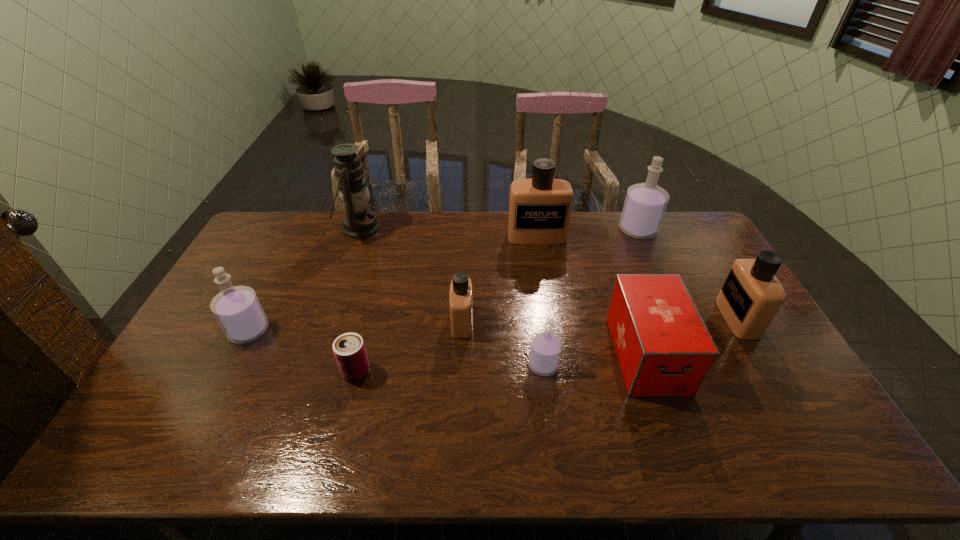
Locate an element on the screen. The width and height of the screenshot is (960, 540). free space located 0.370m on the right of the leftmost perfume is located at coordinates (394, 330).

At what (x,y) coordinates should I click in order to perform the action: click on free spot located on the front label of the rightmost object. Please return your answer as a coordinate pair (x, y). Image resolution: width=960 pixels, height=540 pixels. Looking at the image, I should click on (631, 318).

The width and height of the screenshot is (960, 540). What are the coordinates of `free region located 0.360m on the front label of the rightmost object` in the screenshot? It's located at (605, 318).

Where is `vacant space located 0.120m on the front label of the rightmost object`? vacant space located 0.120m on the front label of the rightmost object is located at coordinates (684, 318).

This screenshot has width=960, height=540. What are the coordinates of `vacant space located on the front label of the smallest beige perfume` in the screenshot? It's located at (523, 322).

Identify the location of vacant space located on the back of the nearest purple perfume. Image resolution: width=960 pixels, height=540 pixels. (540, 339).

The image size is (960, 540). Identify the location of free space located 0.150m on the handle side of the first-aid kit. (682, 457).

I want to click on free space located on the left of the shortest object, so click(x=304, y=371).

The image size is (960, 540). Identify the location of oil lamp positioned at the far edge. (359, 222).

This screenshot has width=960, height=540. I want to click on object positioned at the left edge, so click(x=237, y=309).